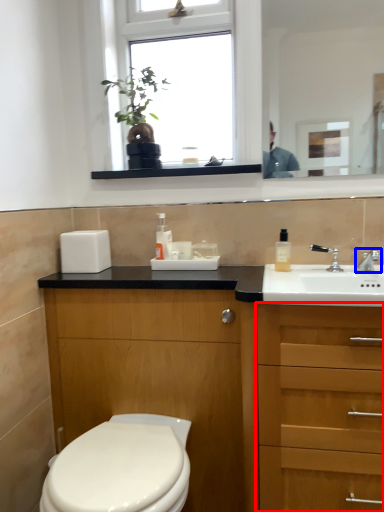
Question: Which object is closer to the camera taking this photo, cabinetry (highlighted by a red box) or tap (highlighted by a blue box)?

Choices:
 (A) cabinetry
 (B) tap

Answer: (A)